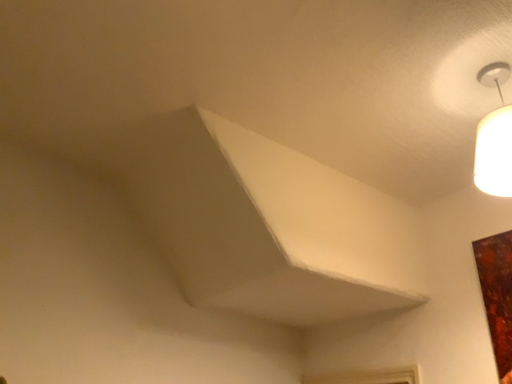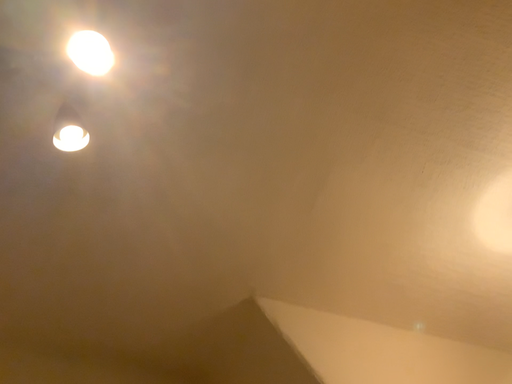
Question: How did the camera likely rotate when shooting the video?

Choices:
 (A) rotated downward
 (B) rotated upward

Answer: (B)